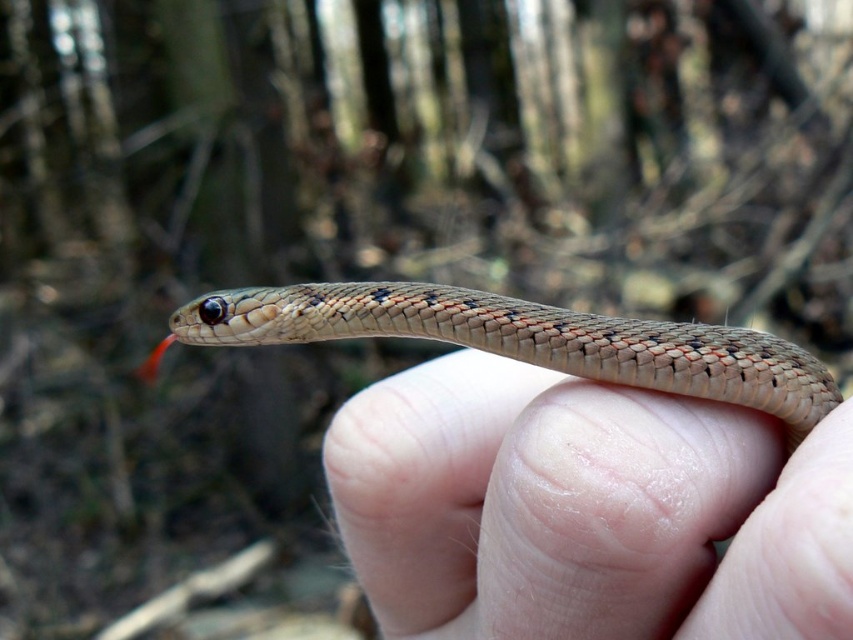
Question: Which point is closer to the camera taking this photo?

Choices:
 (A) (706, 372)
 (B) (489, 544)

Answer: (A)

Question: From the image, what is the correct spatial relationship of smooth skin at center in relation to speckled scales snake at center?

Choices:
 (A) right
 (B) left

Answer: (A)

Question: Is smooth skin at center positioned behind speckled scales snake at center?

Choices:
 (A) no
 (B) yes

Answer: (A)

Question: Does smooth skin at center appear under speckled scales snake at center?

Choices:
 (A) yes
 (B) no

Answer: (A)

Question: Which point appears closest to the camera in this image?

Choices:
 (A) (418, 289)
 (B) (473, 577)

Answer: (A)